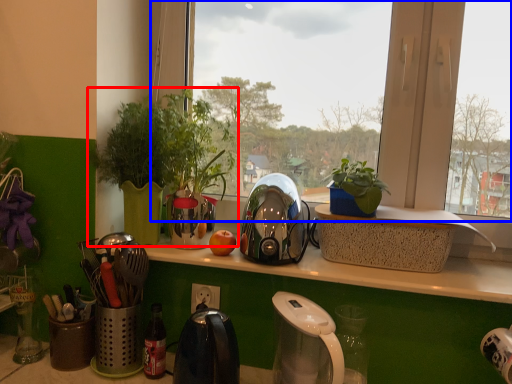
Question: Which of the following is the farthest to the observer, houseplant (highlighted by a red box) or window (highlighted by a blue box)?

Choices:
 (A) houseplant
 (B) window

Answer: (A)